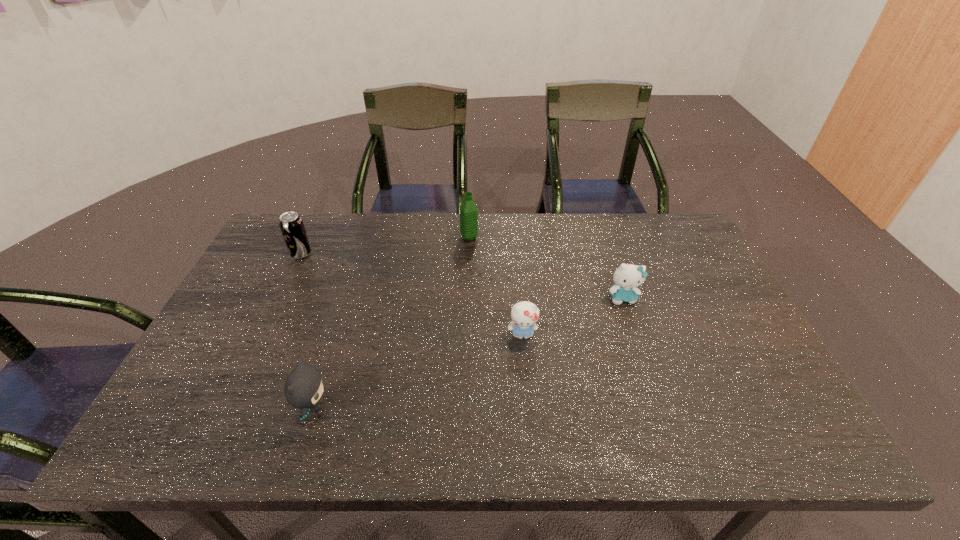
Identify the location of vacant area that lies between the farthest kitten and the fourth farthest object. (572, 316).

Locate an element on the screen. vacant area that lies between the second nearest kitten and the rightmost object is located at coordinates (572, 316).

The height and width of the screenshot is (540, 960). I want to click on free space between the second object from right to left and the soda can, so click(x=412, y=294).

In order to click on vacant space that is in between the leftmost object and the farthest object in this screenshot , I will do `click(385, 246)`.

The height and width of the screenshot is (540, 960). I want to click on vacant space that is in between the rightmost object and the second farthest object, so click(462, 276).

This screenshot has height=540, width=960. I want to click on vacant region between the water bottle and the rightmost object, so click(546, 267).

The width and height of the screenshot is (960, 540). What are the coordinates of `the fourth closest object to the rightmost kitten` in the screenshot? It's located at (291, 225).

Choose which object is the second nearest neighbor to the nearest object. Please provide its 2D coordinates. Your answer should be formatted as a tuple, i.e. [(x, y)], where the tuple contains the x and y coordinates of a point satisfying the conditions above.

[(291, 225)]

The width and height of the screenshot is (960, 540). What are the coordinates of `kitten that can be found as the second closest to the leftmost object` in the screenshot? It's located at (524, 314).

Locate an element on the screen. The height and width of the screenshot is (540, 960). kitten that is the closest to the farthest object is located at coordinates [x=524, y=314].